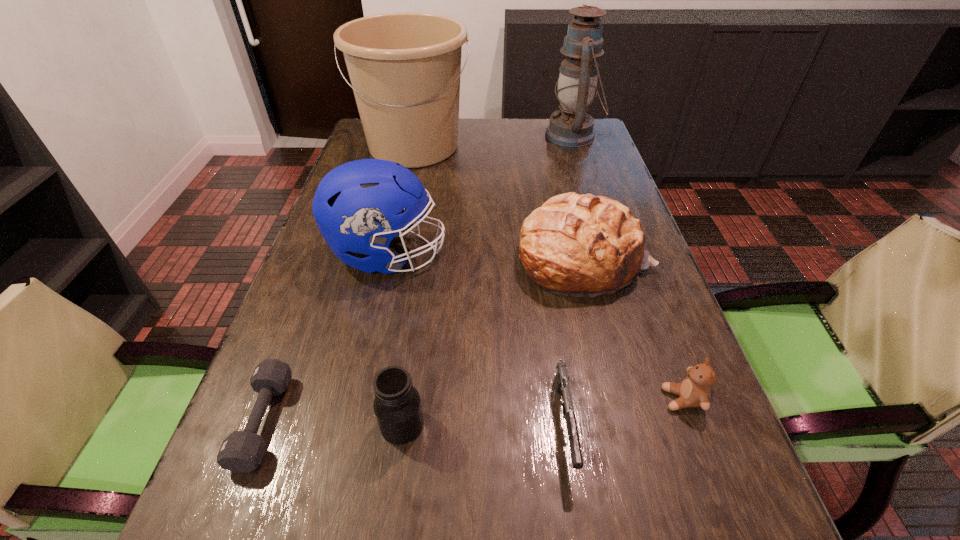
Where is `oil lamp`? oil lamp is located at coordinates (572, 127).

The width and height of the screenshot is (960, 540). What are the coordinates of `bucket` in the screenshot? It's located at (405, 68).

Find the location of `the third tallest object`. the third tallest object is located at coordinates (360, 206).

The image size is (960, 540). What are the coordinates of `bread` in the screenshot? It's located at (584, 245).

Find the location of a particular element. jar is located at coordinates (397, 406).

Find the location of `the sixth tallest object`. the sixth tallest object is located at coordinates (694, 391).

Find the location of a particular element. The height and width of the screenshot is (540, 960). the seventh tallest object is located at coordinates (561, 381).

Where is `dumbbell`? dumbbell is located at coordinates (242, 451).

Where is `vacant space located 0.330m on the front of the oil lamp`? vacant space located 0.330m on the front of the oil lamp is located at coordinates (x=599, y=215).

Image resolution: width=960 pixels, height=540 pixels. Identify the location of vacant space located on the right of the bucket. (526, 146).